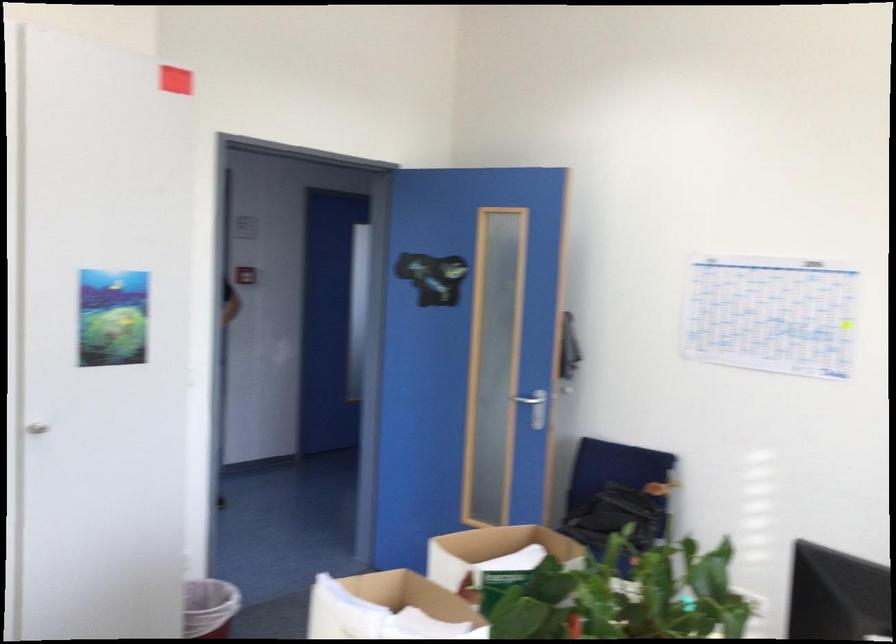
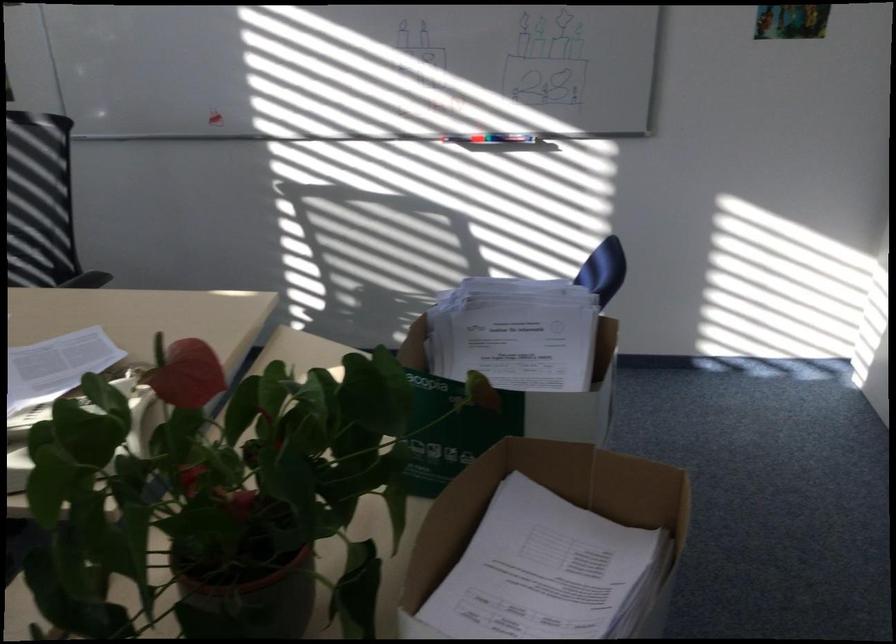
In the second image, find the point that corresponds to (416,573) in the first image.

(550, 515)